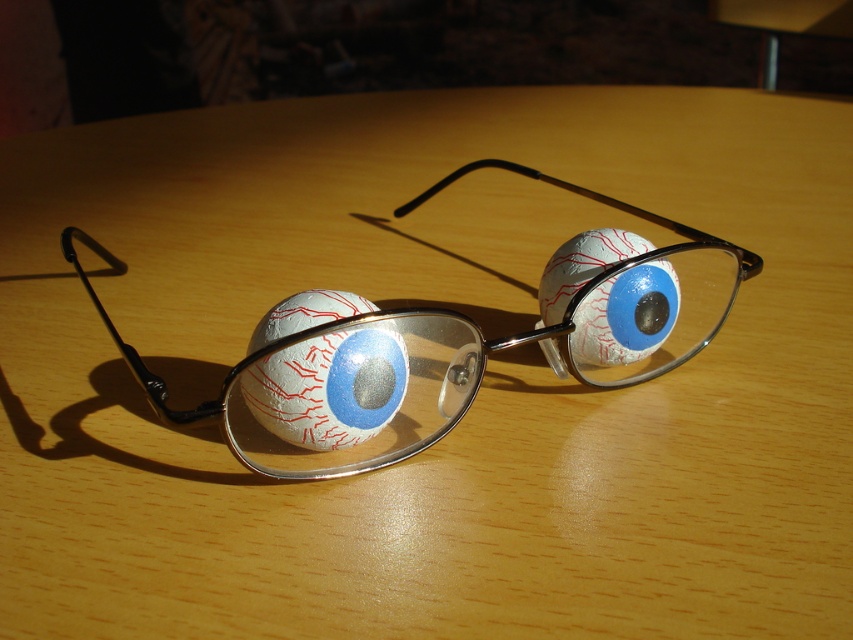
Question: Can you confirm if metallic silver glasses at center is smaller than white textured baseball at center?

Choices:
 (A) yes
 (B) no

Answer: (B)

Question: Which point is closer to the camera taking this photo?

Choices:
 (A) (471, 342)
 (B) (648, 336)
 (C) (331, 385)

Answer: (C)

Question: Which object is farther from the camera taking this photo?

Choices:
 (A) metallic silver glasses at center
 (B) white matte eyeball at center

Answer: (B)

Question: Which point appears farthest from the camera in this image?

Choices:
 (A) (293, 384)
 (B) (558, 321)
 (C) (592, 342)

Answer: (B)

Question: Does metallic silver glasses at center appear under white textured baseball at center?

Choices:
 (A) no
 (B) yes

Answer: (A)

Question: Does metallic silver glasses at center have a larger size compared to white matte eyeball at center?

Choices:
 (A) yes
 (B) no

Answer: (A)